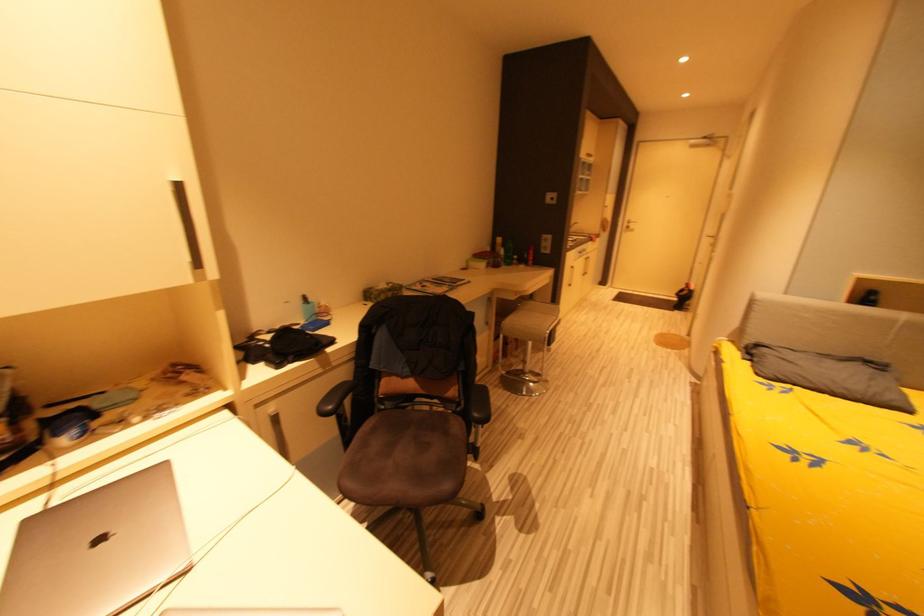
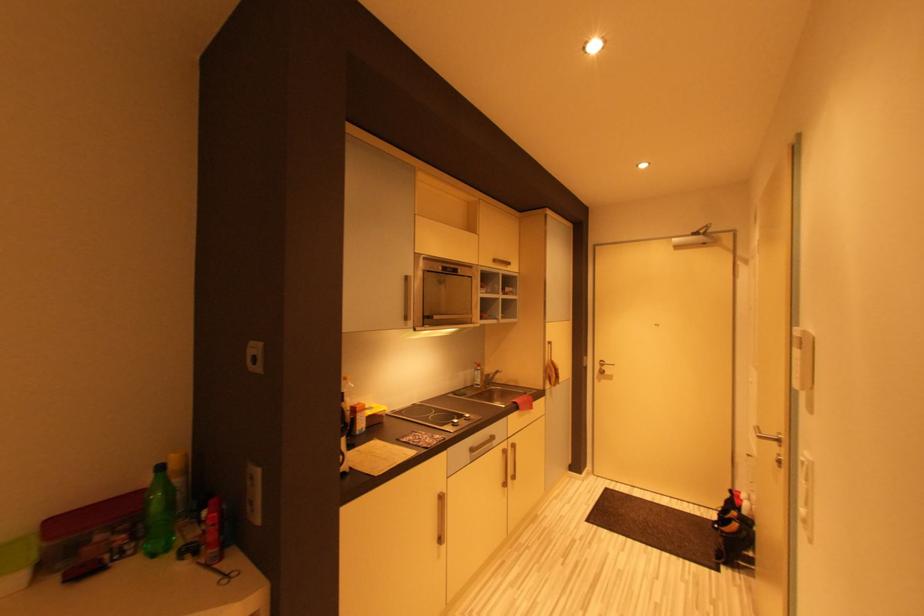
In a continuous first-person perspective shot, in which direction is the camera moving?

The movement direction of the cameraman is right, forward.